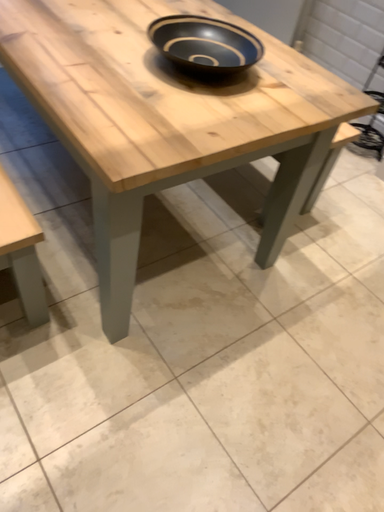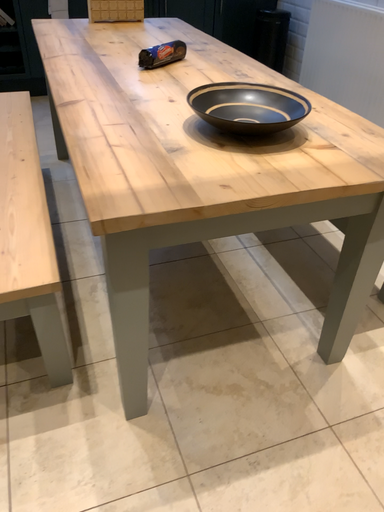
Question: How did the camera likely rotate when shooting the video?

Choices:
 (A) rotated upward
 (B) rotated downward

Answer: (A)